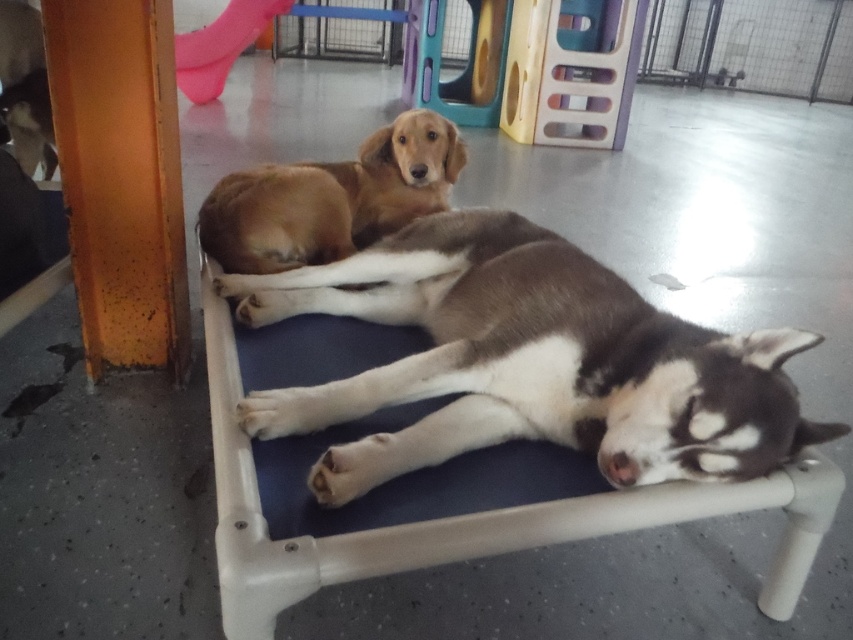
Question: Can you confirm if brown fur dog at center is smaller than golden brown fur at center?

Choices:
 (A) no
 (B) yes

Answer: (A)

Question: Does brown fur dog at center appear on the left side of golden brown fur at center?

Choices:
 (A) no
 (B) yes

Answer: (A)

Question: Which of the following is the farthest from the observer?

Choices:
 (A) (314, 202)
 (B) (444, 298)

Answer: (A)

Question: Is the position of brown fur dog at center more distant than that of golden brown fur at center?

Choices:
 (A) no
 (B) yes

Answer: (A)

Question: Which object is farther from the camera taking this photo?

Choices:
 (A) golden brown fur at center
 (B) brown fur dog at center

Answer: (A)